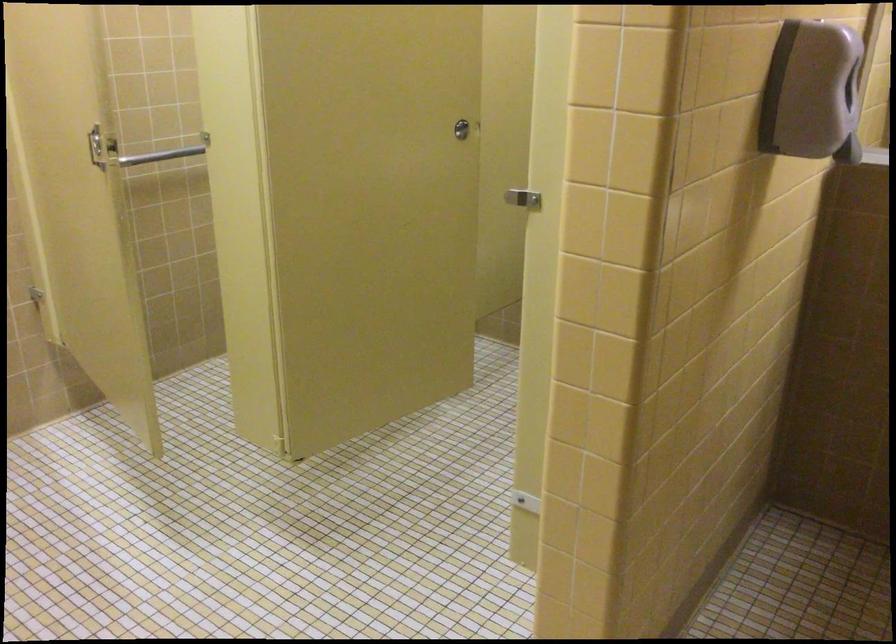
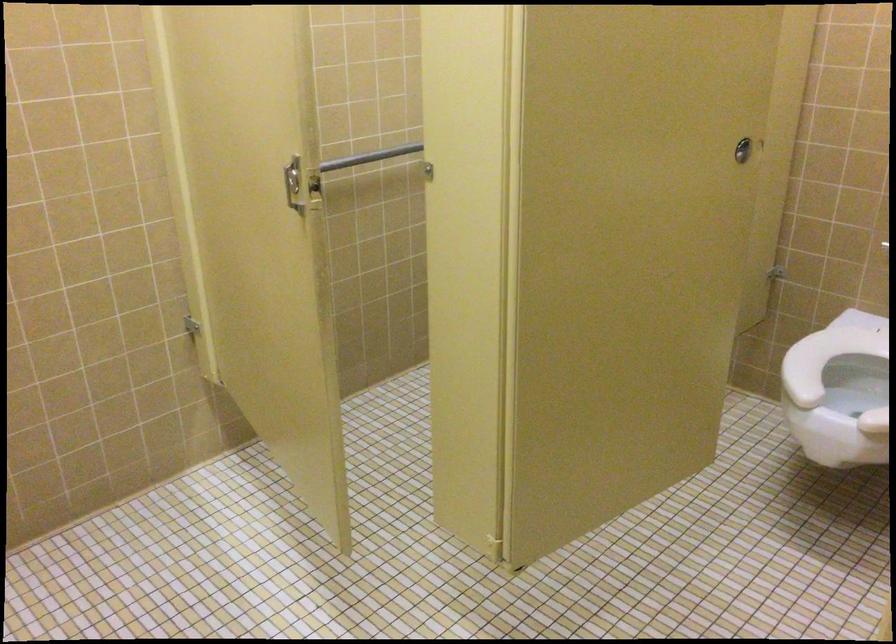
Where in the second image is the point corresponding to point 97,153 from the first image?

(293, 184)